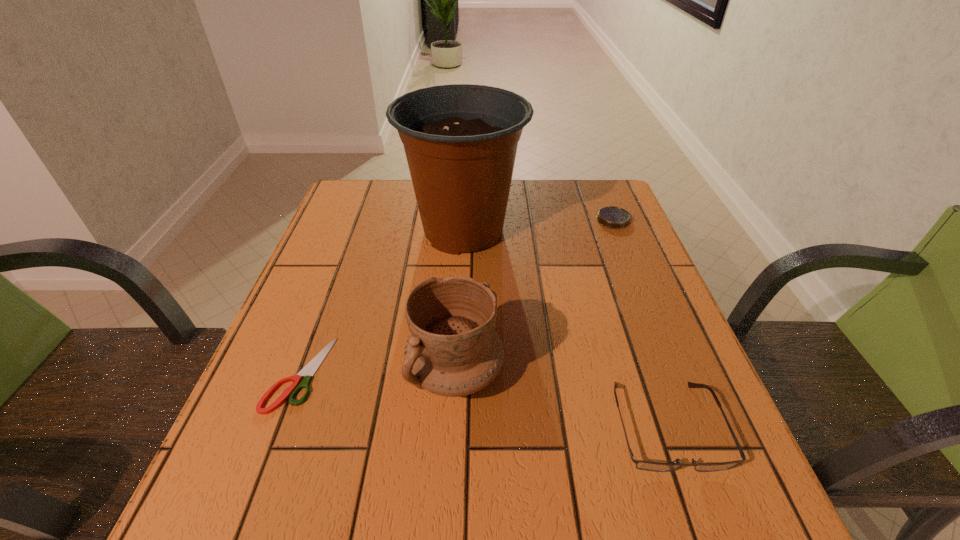
Image resolution: width=960 pixels, height=540 pixels. I want to click on flowerpot, so click(x=460, y=140).

The width and height of the screenshot is (960, 540). Identify the location of the second tallest object. (453, 350).

You are a GUI agent. You are given a task and a screenshot of the screen. Output one action in this format:
    pyautogui.click(x=<x>, y=<y>)
    Task: Click on the third shortest object
    This screenshot has height=540, width=960.
    Given the screenshot: What is the action you would take?
    pyautogui.click(x=640, y=464)

Locate an element on the screen. This screenshot has height=540, width=960. the second shortest object is located at coordinates (612, 217).

At what (x,y) coordinates should I click in order to perform the action: click on scissors. Please return your answer as a coordinate pair (x, y). The height and width of the screenshot is (540, 960). Looking at the image, I should click on (309, 370).

Where is `the shortest object`? This screenshot has height=540, width=960. the shortest object is located at coordinates (309, 370).

At what (x,y) coordinates should I click in order to perform the action: click on free region located 0.230m on the right of the tallest object. Please return your answer as a coordinate pair (x, y). This screenshot has height=540, width=960. Looking at the image, I should click on (612, 231).

The image size is (960, 540). Identify the location of vacant space situated 0.160m on the right of the second tallest object. (588, 373).

Identify the location of vacant space situated 0.070m on the left of the fourth tallest object. The height and width of the screenshot is (540, 960). (571, 220).

Locate an element on the screen. The image size is (960, 540). vacant area located 0.290m on the right of the leftmost object is located at coordinates (483, 374).